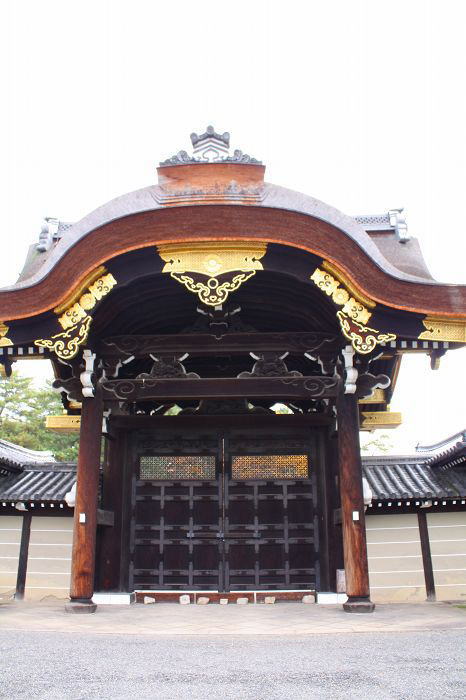
Identify the location of handle. (206, 533), (240, 533).